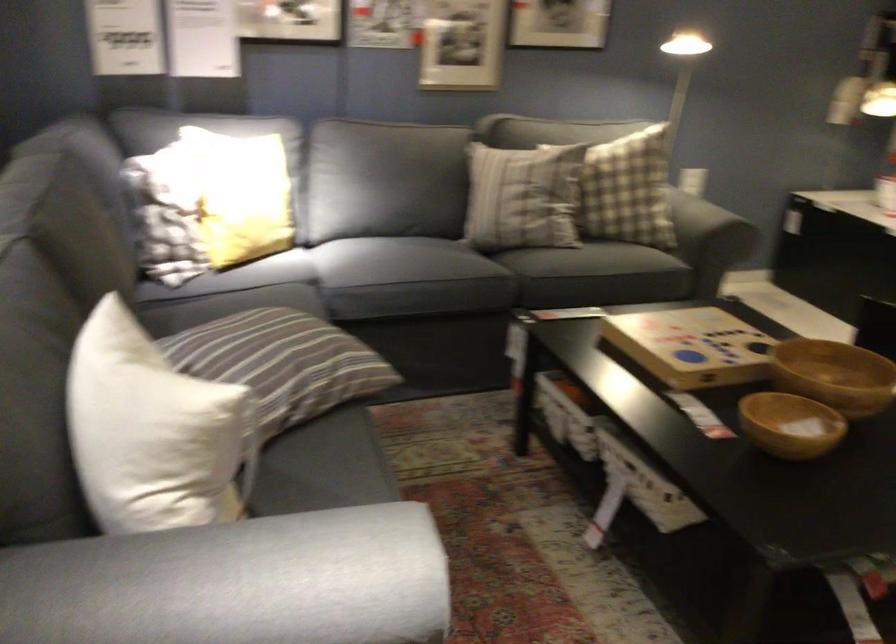
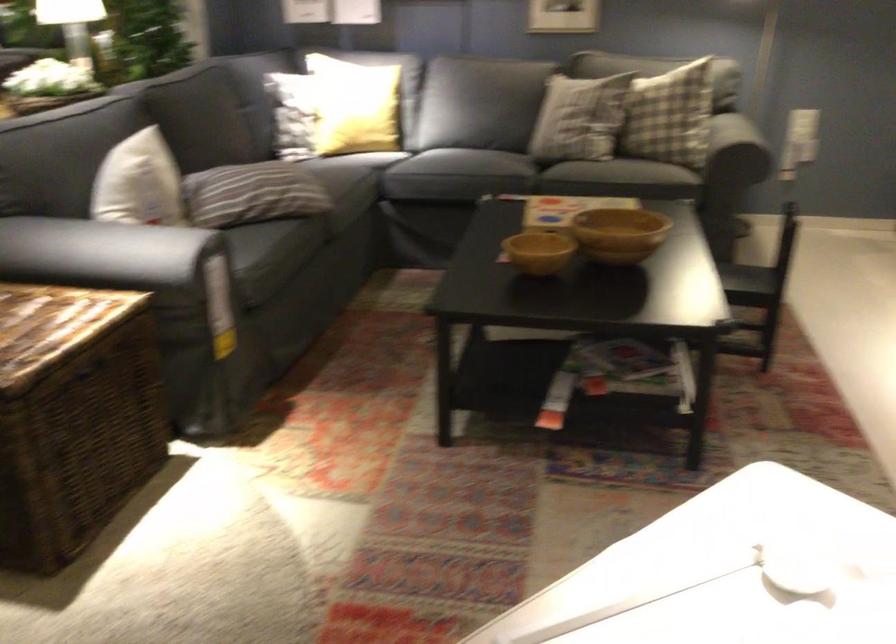
Where in the second image is the point corresponding to (333,261) from the first image?

(386, 149)